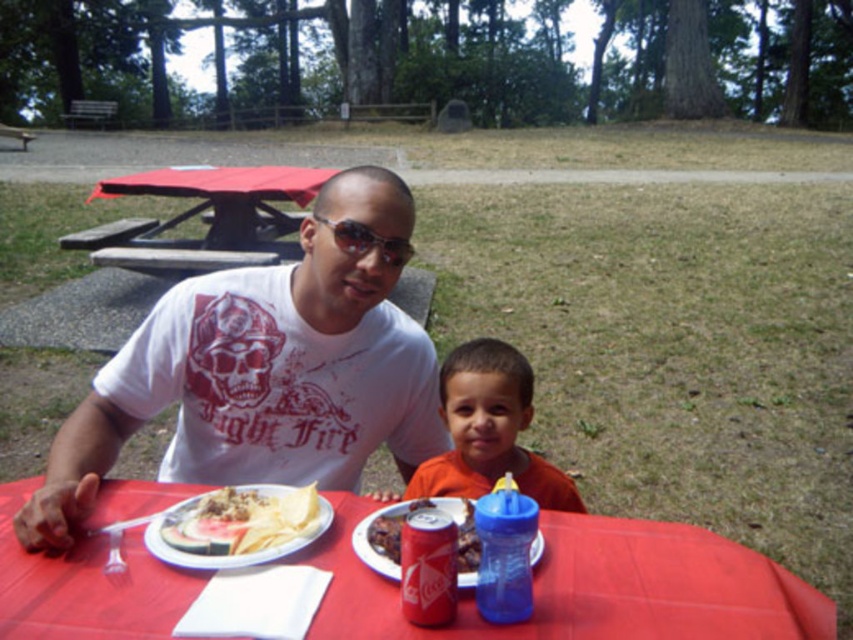
You are planning to place a rectangular box that is 1 meter long on the table. Given the red plastic picnic table at upper left and the blue plastic sippy cup at lower right, which object can accommodate the box in terms of width?

The red plastic picnic table at upper left can accommodate the box since its width is greater than the blue plastic sippy cup at lower right.

Based on the photo, you are a park visitor who wants to place a blue plastic sippy cup at lower right on the red plastic table at center. Can you do that without moving any other items on the table?

The red plastic table at center is located below the blue plastic sippy cup at lower right, so the sippy cup is already placed on the table.

In the scene shown: You are a parent trying to hand your child the blue plastic sippy cup at lower right. The child is sitting at the red plastic picnic table at upper left. Do you need to bend down to hand the cup to the child?

The red plastic picnic table at upper left is much taller than the blue plastic sippy cup at lower right. Since the table is taller, you would need to bend down to reach the child sitting at the table and hand them the cup.